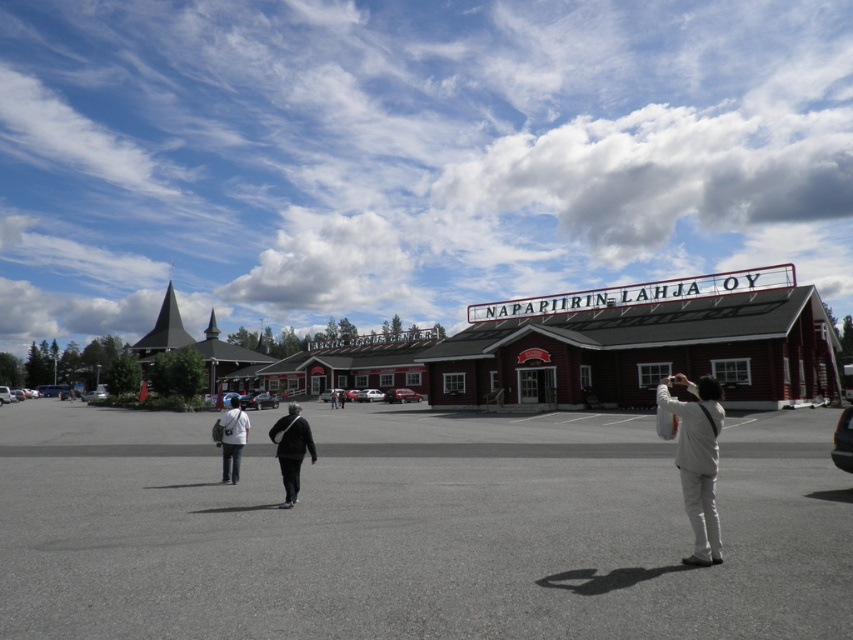
You are standing at the point labeled as point (415,529) in the image. What is the surface material under your feet?

The surface material under your feet at point (415,529) is gray asphalt parking lot at center.

You are a photographer carrying a white fabric camera at center and a light beige fabric bag at center. You want to ensure that the camera is visible in your shot. Based on their positions, which item should you adjust to make sure the camera is not blocked?

The white fabric camera at center is positioned over light beige fabric bag at center, so you should adjust the light beige fabric bag at center to move it out from under the camera to prevent blocking.

You are standing in the parking lot and want to take a photo of the building with the large sign. The camera you need is located at the point with coordinates (697, 460). Can you reach it before the people walking towards the building on the right? The people are currently halfway between you and the camera.

The point (697, 460) corresponds to the white fabric camera at center. Since the people are halfway between you and the camera, you can reach the camera before they do if you move quickly.